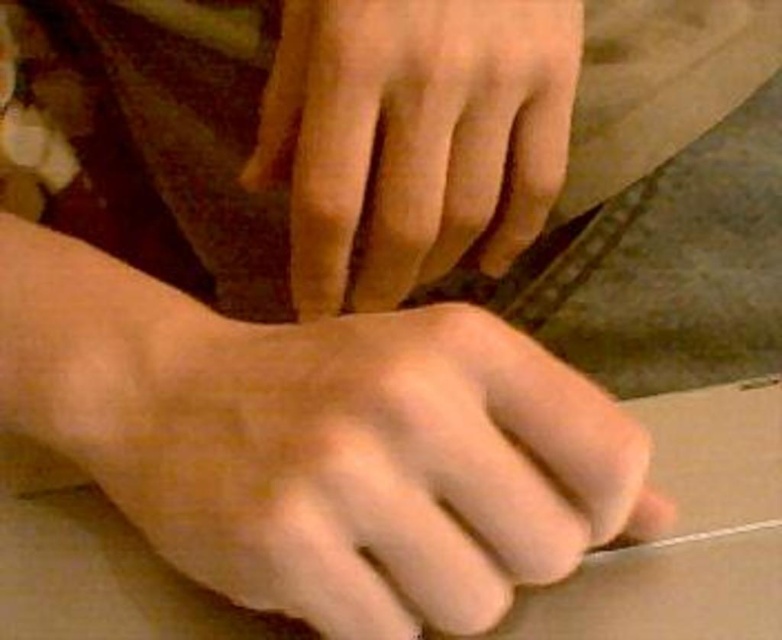
Can you confirm if smooth skin hand at lower center is positioned to the left of smooth skin hand at center?

Yes, smooth skin hand at lower center is to the left of smooth skin hand at center.

Which is behind, point (267, 408) or point (494, 145)?

The point (494, 145) is more distant.

Image resolution: width=782 pixels, height=640 pixels. I want to click on smooth skin hand at lower center, so click(x=364, y=461).